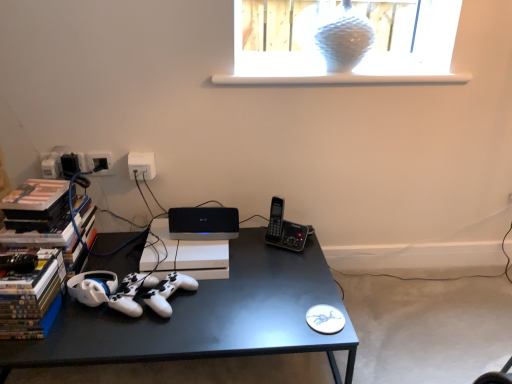
The height and width of the screenshot is (384, 512). I want to click on white plastic electrical outlet at upper center, so pyautogui.click(x=141, y=165).

Find the location of a particular element. Image resolution: width=512 pixels, height=384 pixels. white matte game controller at center is located at coordinates (168, 292).

What do you see at coordinates (168, 292) in the screenshot? I see `white matte game controller at center` at bounding box center [168, 292].

Looking at this image, measure the distance between point (278, 211) and camera.

Point (278, 211) and camera are 5.01 feet apart.

Describe the element at coordinates (342, 79) in the screenshot. I see `white matte window sill at upper center` at that location.

Identify the location of white plastic electrical outlet at upper center. The height and width of the screenshot is (384, 512). (141, 165).

From the picture: From the image's perspective, is black matte desk at center on hardcover books at left?

Incorrect, from the image's perspective, black matte desk at center is lower than hardcover books at left.

Is point (212, 289) closer or farther from the camera than point (50, 302)?

Point (212, 289) is farther from the camera than point (50, 302).

Which object is more forward, black matte desk at center or hardcover books at left?

hardcover books at left.

Based on the photo, which object is thinner, black matte desk at center or hardcover books at left?

Thinner between the two is hardcover books at left.

Can you confirm if white plastic electrical outlet at upper center is shorter than white matte window sill at upper center?

No, white plastic electrical outlet at upper center is not shorter than white matte window sill at upper center.

From the image's perspective, is white plastic electrical outlet at upper center beneath white matte window sill at upper center?

Correct, white plastic electrical outlet at upper center appears lower than white matte window sill at upper center in the image.

What's the angular difference between white plastic electrical outlet at upper center and white matte window sill at upper center's facing directions?

white plastic electrical outlet at upper center and white matte window sill at upper center are facing 1.91 degrees away from each other.

Is white plastic electrical outlet at upper center directly adjacent to white matte window sill at upper center?

They are not placed beside each other.

Does white matte window sill at upper center have a larger size compared to black matte desk at center?

Actually, white matte window sill at upper center might be smaller than black matte desk at center.

The width and height of the screenshot is (512, 384). In order to click on desk in front of the white matte window sill at upper center in this screenshot , I will do `click(206, 317)`.

Which is more to the right, white matte window sill at upper center or black matte desk at center?

white matte window sill at upper center.

This screenshot has width=512, height=384. In order to click on gadget behind the white matte game controller at center in this screenshot , I will do `click(284, 229)`.

Based on the photo, from the image's perspective, is white matte game controller at center located beneath black plastic phone at right?

Indeed, from the image's perspective, white matte game controller at center is shown beneath black plastic phone at right.

Is white matte game controller at center inside or outside of black plastic phone at right?

white matte game controller at center lies outside black plastic phone at right.

Between point (166, 278) and point (306, 226), which one is positioned behind?

Positioned behind is point (306, 226).

Looking at their sizes, would you say white matte window sill at upper center is wider or thinner than white plastic electrical outlet at upper center?

Clearly, white matte window sill at upper center has more width compared to white plastic electrical outlet at upper center.

Does white matte window sill at upper center have a larger size compared to white plastic electrical outlet at upper center?

Yes, white matte window sill at upper center is bigger than white plastic electrical outlet at upper center.

Is white matte window sill at upper center to the right of white plastic electrical outlet at upper center from the viewer's perspective?

Yes, white matte window sill at upper center is to the right of white plastic electrical outlet at upper center.

Image resolution: width=512 pixels, height=384 pixels. Find the location of `glass vase above the black matte desk at center (from the image's perspective)`. glass vase above the black matte desk at center (from the image's perspective) is located at coordinates (344, 38).

Measure the distance from transparent textured glass vase at upper center to black matte desk at center.

transparent textured glass vase at upper center and black matte desk at center are 34.59 inches apart.

Which of these two, transparent textured glass vase at upper center or black matte desk at center, is smaller?

Smaller between the two is transparent textured glass vase at upper center.

Is transparent textured glass vase at upper center far from black matte desk at center?

transparent textured glass vase at upper center is actually quite close to black matte desk at center.

In the scene shown: Is white matte game controller at center surrounding white matte window sill at upper center?

That's incorrect, white matte window sill at upper center is not inside white matte game controller at center.

Between white matte game controller at center and white matte window sill at upper center, which one has larger size?

Bigger between the two is white matte window sill at upper center.

Is white matte game controller at center closer to camera compared to white matte window sill at upper center?

That is True.

From a real-world perspective, is white matte game controller at center under white matte window sill at upper center?

Correct, in the physical world, white matte game controller at center is lower than white matte window sill at upper center.

You are a GUI agent. You are given a task and a screenshot of the screen. Output one action in this format:
    pyautogui.click(x=<x>, y=<y>)
    Task: Click on the paperback book in front of the black matte desk at center
    The image size is (512, 384).
    Given the screenshot: What is the action you would take?
    pyautogui.click(x=31, y=297)

Find the location of a particular element. The height and width of the screenshot is (384, 512). window sill to the right of white plastic electrical outlet at upper center is located at coordinates (342, 79).

Based on their spatial positions, is transparent textured glass vase at upper center or black matte desk at center closer to hardcover books at left?

black matte desk at center is closer to hardcover books at left.

Which object lies nearer to the anchor point black plastic phone at right, white matte game controller at center or hardcover books at left?

white matte game controller at center lies closer to black plastic phone at right than the other object.

Looking at the image, which one is located closer to black matte desk at center, hardcover books at left or white matte game controller at center?

white matte game controller at center lies closer to black matte desk at center than the other object.

Estimate the real-world distances between objects in this image. Which object is closer to black matte desk at center, white matte game controller at center or transparent textured glass vase at upper center?

Among the two, white matte game controller at center is located nearer to black matte desk at center.

From the image, which object appears to be farther from white matte game controller at center, white matte window sill at upper center or white plastic electrical outlet at upper center?

The object further to white matte game controller at center is white matte window sill at upper center.

Looking at the image, which one is located further to white matte window sill at upper center, hardcover books at left or white plastic electrical outlet at upper center?

hardcover books at left.

Considering their positions, is hardcover books at left positioned closer to white plastic electrical outlet at upper center than transparent textured glass vase at upper center?

Based on the image, hardcover books at left appears to be nearer to white plastic electrical outlet at upper center.

Based on their spatial positions, is black plastic phone at right or white plastic electrical outlet at upper center closer to white matte game controller at center?

black plastic phone at right is closer to white matte game controller at center.

At what (x,y) coordinates should I click in order to perform the action: click on desk between white plastic electrical outlet at upper center and black plastic phone at right in the horizontal direction. Please return your answer as a coordinate pair (x, y). This screenshot has width=512, height=384. Looking at the image, I should click on tap(206, 317).

Find the location of a particular element. The width and height of the screenshot is (512, 384). gadget between transparent textured glass vase at upper center and black matte desk at center from top to bottom is located at coordinates (284, 229).

Where is `gadget that lies between white matte window sill at upper center and black matte desk at center from top to bottom`? This screenshot has width=512, height=384. gadget that lies between white matte window sill at upper center and black matte desk at center from top to bottom is located at coordinates (284, 229).

This screenshot has height=384, width=512. I want to click on gadget between white plastic electrical outlet at upper center and transparent textured glass vase at upper center in the horizontal direction, so click(x=284, y=229).